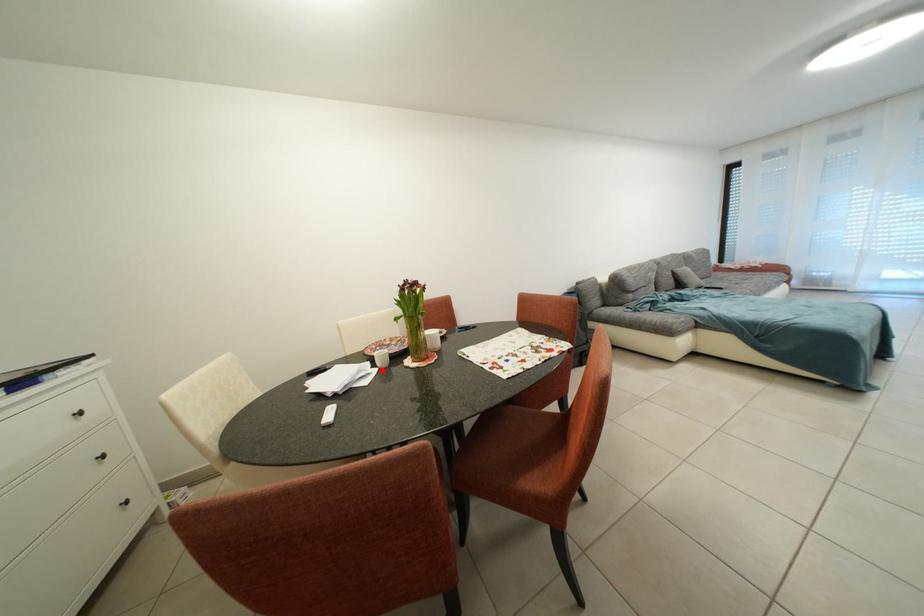
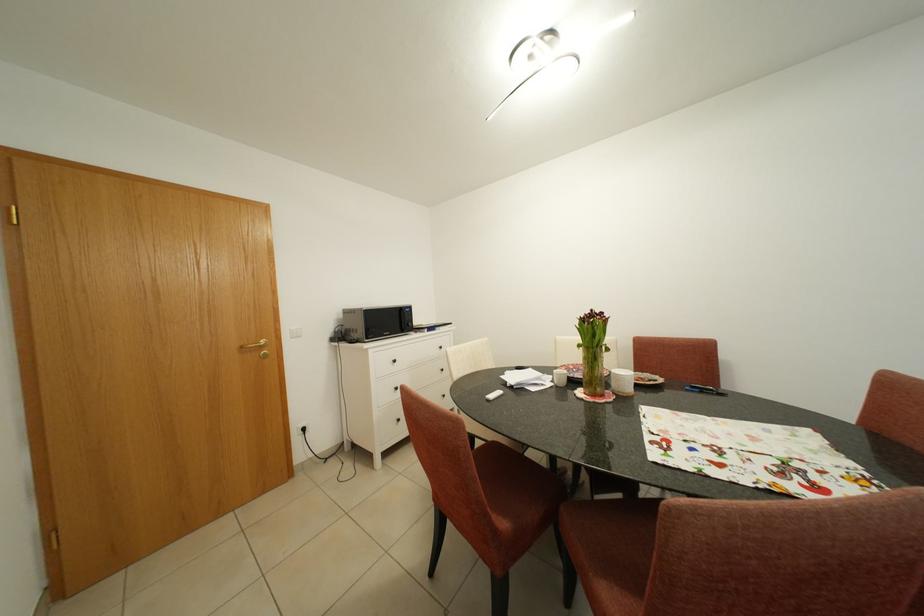
Find the pixel in the second image that matches the highlighted location in the first image.

(561, 385)